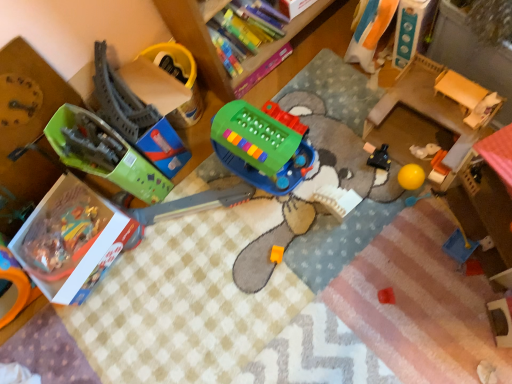
In order to click on empty space that is in between wooden changing table at right and green plastic toy at center, arranged as the 4th toy when viewed from the right in this screenshot , I will do (339, 144).